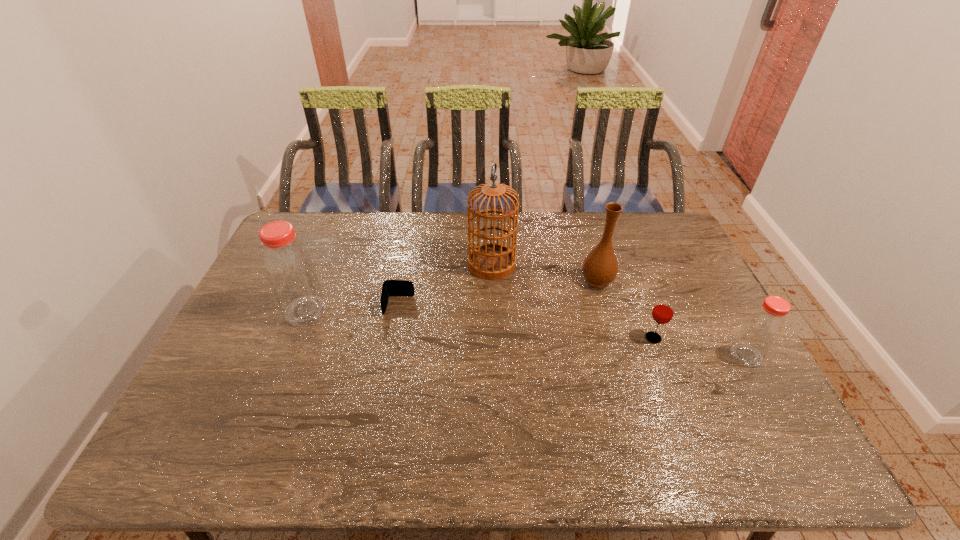
I want to click on vacant space at the far edge of the desktop, so click(x=628, y=247).

The image size is (960, 540). I want to click on vacant space at the near edge, so click(422, 411).

At what (x,y) coordinates should I click in order to perform the action: click on free space at the left edge of the desktop. Please return your answer as a coordinate pair (x, y). Looking at the image, I should click on (226, 343).

The width and height of the screenshot is (960, 540). In the image, there is a desktop. Identify the location of blank space at the right edge. (756, 376).

Where is `vacant space at the far left corner of the desktop`? Image resolution: width=960 pixels, height=540 pixels. vacant space at the far left corner of the desktop is located at coordinates (297, 235).

Find the location of `vacant space at the far right corner of the desktop`. vacant space at the far right corner of the desktop is located at coordinates (651, 229).

You are a GUI agent. You are given a task and a screenshot of the screen. Output one action in this format:
    pyautogui.click(x=<x>, y=<y>)
    Task: Click on the vacant space that's between the fifth object from right to left and the birdcage
    This screenshot has height=540, width=960.
    Given the screenshot: What is the action you would take?
    pyautogui.click(x=445, y=285)

This screenshot has width=960, height=540. Identify the location of free space between the fourth object from left to right and the third object from left to right. (544, 272).

Find the location of a particular element. The image size is (960, 540). unoccupied position between the vase and the taller bottle is located at coordinates (451, 295).

Locate an element on the screen. The height and width of the screenshot is (540, 960). free space that is in between the shortest object and the third shortest object is located at coordinates pyautogui.click(x=572, y=330).